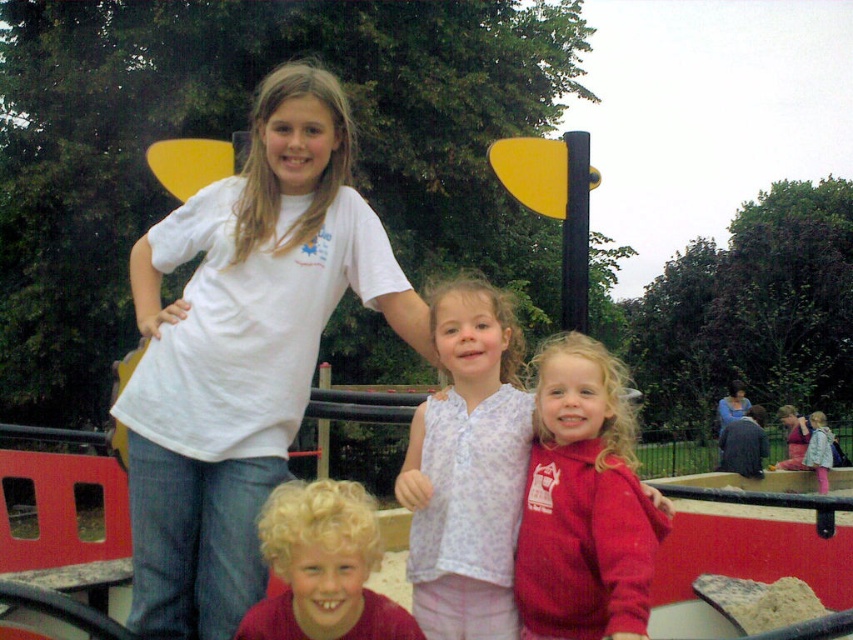
You are a photographer trying to capture a group photo of the children in the playground. You notice the red fleece jacket at center and the curly blonde hair at center. Which child should you adjust to ensure both are visible in the photo?

The red fleece jacket at center is much taller than the curly blonde hair at center, so you should lower the angle of the camera to ensure both are visible in the photo.